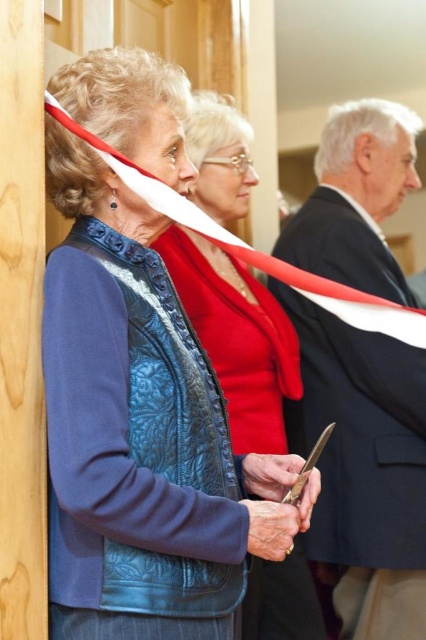
Question: Which point is farther to the camera?

Choices:
 (A) dark gray suit at right
 (B) blue quilted leather jacket at center

Answer: (A)

Question: Is dark gray suit at right to the right of blue quilted leather jacket at center from the viewer's perspective?

Choices:
 (A) yes
 (B) no

Answer: (A)

Question: Is dark gray suit at right smaller than blue quilted leather jacket at center?

Choices:
 (A) yes
 (B) no

Answer: (B)

Question: Which of the following is the farthest from the observer?

Choices:
 (A) dark gray suit at right
 (B) blue quilted leather jacket at center

Answer: (A)

Question: From the image, what is the correct spatial relationship of dark gray suit at right in relation to blue quilted leather jacket at center?

Choices:
 (A) left
 (B) right

Answer: (B)